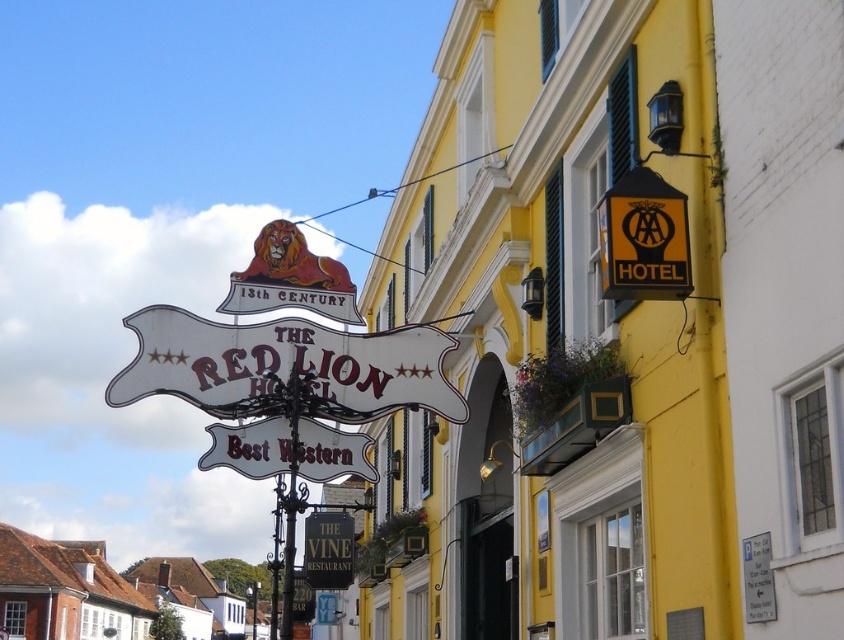
You are standing in front of the hotel and want to take a photo of both the brown tiled roofs at lower left and the black signboard at center. Which object should you focus on first to ensure both are in the frame?

You should focus on the brown tiled roofs at lower left first because it is closer to you than the black signboard at center, ensuring both are in the frame.

What is the spatial relationship between the brown tiled roofs at lower left and the black signboard at center?

The brown tiled roofs at lower left are located to the left of the black signboard at center.